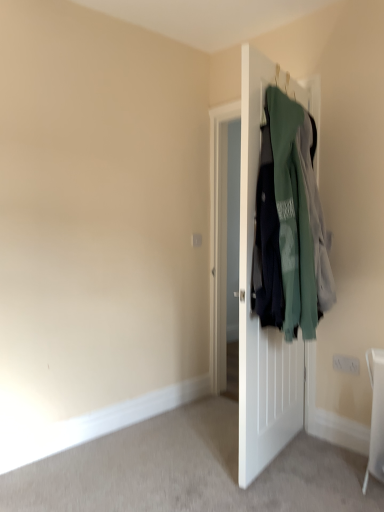
Find the location of `green fabric jackets at right`. green fabric jackets at right is located at coordinates (291, 223).

The width and height of the screenshot is (384, 512). What do you see at coordinates (291, 223) in the screenshot? I see `green fabric jackets at right` at bounding box center [291, 223].

In order to face green fabric jackets at right, should I rotate leftwards or rightwards?

To face it directly, rotate right by 14.392 degrees.

At what (x,y) coordinates should I click in order to perform the action: click on white matte door at center. Please return your answer as a coordinate pair (x, y). Looking at the image, I should click on (250, 276).

What do you see at coordinates (250, 276) in the screenshot?
I see `white matte door at center` at bounding box center [250, 276].

Where is `green fabric jackets at right`? The width and height of the screenshot is (384, 512). green fabric jackets at right is located at coordinates (291, 223).

Can you confirm if white matte door at center is positioned to the right of green fabric jackets at right?

No.

Which is behind, white matte door at center or green fabric jackets at right?

white matte door at center is further from the camera.

Is point (263, 106) positioned behind point (293, 259)?

Yes, it is behind point (293, 259).

From the image's perspective, relative to green fabric jackets at right, is white matte door at center above or below?

white matte door at center is below green fabric jackets at right.

Consider the image. From a real-world perspective, is white matte door at center beneath green fabric jackets at right?

Yes, from a real-world perspective, white matte door at center is under green fabric jackets at right.

Between white matte door at center and green fabric jackets at right, which one has smaller width?

white matte door at center is thinner.

Considering the sizes of white matte door at center and green fabric jackets at right in the image, is white matte door at center taller or shorter than green fabric jackets at right?

In the image, white matte door at center appears to be taller than green fabric jackets at right.

In terms of size, does white matte door at center appear bigger or smaller than green fabric jackets at right?

white matte door at center is smaller than green fabric jackets at right.

Is white matte door at center not inside green fabric jackets at right?

Actually, white matte door at center is at least partially inside green fabric jackets at right.

Is white matte door at center not close to green fabric jackets at right?

No.

Could you tell me if white matte door at center is facing green fabric jackets at right?

Yes, white matte door at center is facing green fabric jackets at right.

Can you tell me how much white matte door at center and green fabric jackets at right differ in facing direction?

white matte door at center and green fabric jackets at right are facing 176 degrees away from each other.

Locate an element on the screen. The width and height of the screenshot is (384, 512). laundry on the right side of white matte door at center is located at coordinates (291, 223).

Can you confirm if green fabric jackets at right is positioned to the left of white matte door at center?

Incorrect, green fabric jackets at right is not on the left side of white matte door at center.

Relative to white matte door at center, is green fabric jackets at right in front or behind?

Visually, green fabric jackets at right is located in front of white matte door at center.

Which is farther from the camera, (292, 309) or (260, 453)?

Point (260, 453)

From the image's perspective, which one is positioned lower, green fabric jackets at right or white matte door at center?

white matte door at center.

From a real-world perspective, relative to white matte door at center, is green fabric jackets at right vertically above or below?

Clearly, from a real-world perspective, green fabric jackets at right is above white matte door at center.

Considering the sizes of green fabric jackets at right and white matte door at center in the image, is green fabric jackets at right wider or thinner than white matte door at center?

Considering their sizes, green fabric jackets at right looks broader than white matte door at center.

Between green fabric jackets at right and white matte door at center, which one has less height?

green fabric jackets at right is shorter.

Between green fabric jackets at right and white matte door at center, which one has larger size?

green fabric jackets at right.

Is white matte door at center located within green fabric jackets at right?

Yes, white matte door at center is a part of green fabric jackets at right.

Does green fabric jackets at right touch white matte door at center?

No, green fabric jackets at right is not in contact with white matte door at center.

From the picture: Does green fabric jackets at right turn towards white matte door at center?

Yes, green fabric jackets at right is facing white matte door at center.

How different are the orientations of green fabric jackets at right and white matte door at center in degrees?

176 degrees.

Image resolution: width=384 pixels, height=512 pixels. Find the location of `door below the green fabric jackets at right (from the image's perspective)`. door below the green fabric jackets at right (from the image's perspective) is located at coordinates (250, 276).

This screenshot has width=384, height=512. What are the coordinates of `laundry above the white matte door at center (from the image's perspective)` in the screenshot? It's located at (291, 223).

Where is `door behind the green fabric jackets at right`? The width and height of the screenshot is (384, 512). door behind the green fabric jackets at right is located at coordinates (250, 276).